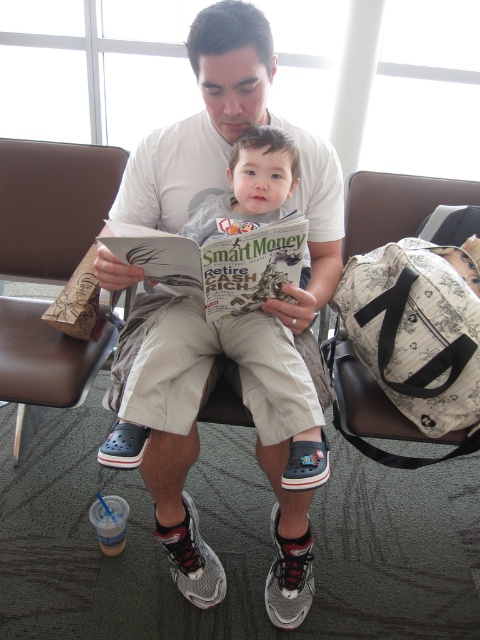
You are a luggage cart that is 50 centimeters wide. You need to move between the gray cotton shirt at center and the brown leather armchair at left. Can you fit through the space between them?

The distance between the gray cotton shirt at center and the brown leather armchair at left is 49.22 centimeters. Since the luggage cart is 50 centimeters wide, it cannot fit through the space between them.

You are a photographer trying to capture a candid shot of the man and child in the airport scene. To ensure the gray cotton shirt at center is centered in your photo, where should you position your camera relative to the scene?

The gray cotton shirt at center is located at point (197, 438), so you should position your camera to focus on that coordinate to center the shirt in the photo.